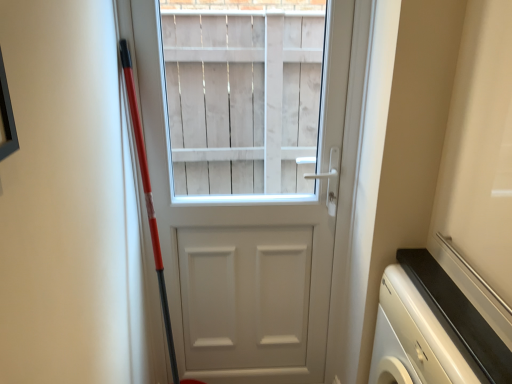
Question: Considering the positions of point (166, 372) and point (428, 345), is point (166, 372) closer or farther from the camera than point (428, 345)?

Choices:
 (A) farther
 (B) closer

Answer: (A)

Question: Relative to white glossy dishwasher at lower right, is white matte door at center in front or behind?

Choices:
 (A) behind
 (B) front

Answer: (A)

Question: Is white matte door at center taller or shorter than white glossy dishwasher at lower right?

Choices:
 (A) tall
 (B) short

Answer: (A)

Question: From the image's perspective, is white glossy dishwasher at lower right positioned above or below white matte door at center?

Choices:
 (A) above
 (B) below

Answer: (B)

Question: Based on their sizes in the image, would you say white glossy dishwasher at lower right is bigger or smaller than white matte door at center?

Choices:
 (A) big
 (B) small

Answer: (A)

Question: From a real-world perspective, is white glossy dishwasher at lower right positioned above or below white matte door at center?

Choices:
 (A) below
 (B) above

Answer: (A)

Question: Considering the positions of white glossy dishwasher at lower right and white matte door at center in the image, is white glossy dishwasher at lower right taller or shorter than white matte door at center?

Choices:
 (A) short
 (B) tall

Answer: (A)